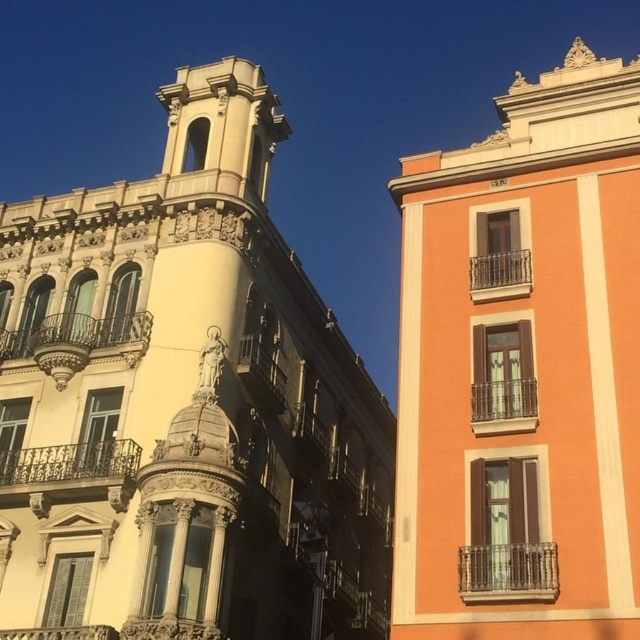
Question: Which object is farther from the camera taking this photo?

Choices:
 (A) matte gold bell tower at center
 (B) matte orange building at upper right

Answer: (A)

Question: Can you confirm if matte gold bell tower at center is wider than matte orange building at upper right?

Choices:
 (A) yes
 (B) no

Answer: (B)

Question: Which of the following is the closest to the observer?

Choices:
 (A) matte gold bell tower at center
 (B) matte orange building at upper right

Answer: (B)

Question: Which of the following is the closest to the observer?

Choices:
 (A) (317, 524)
 (B) (573, 252)

Answer: (B)

Question: Is matte gold bell tower at center smaller than matte orange building at upper right?

Choices:
 (A) no
 (B) yes

Answer: (B)

Question: Does matte gold bell tower at center lie in front of matte orange building at upper right?

Choices:
 (A) no
 (B) yes

Answer: (A)